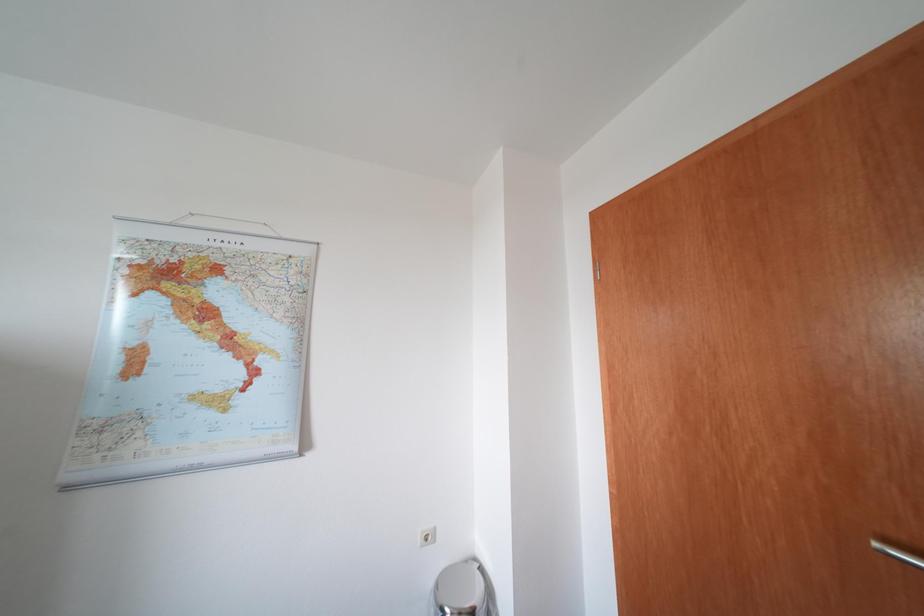
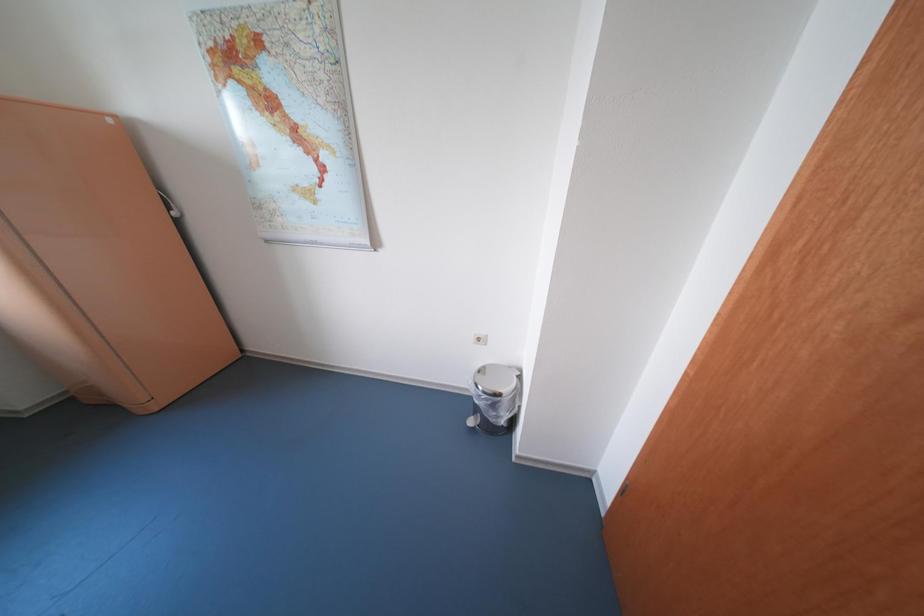
The images are taken continuously from a first-person perspective. In which direction is your viewpoint rotating?

The rotation direction of the camera is left-down.